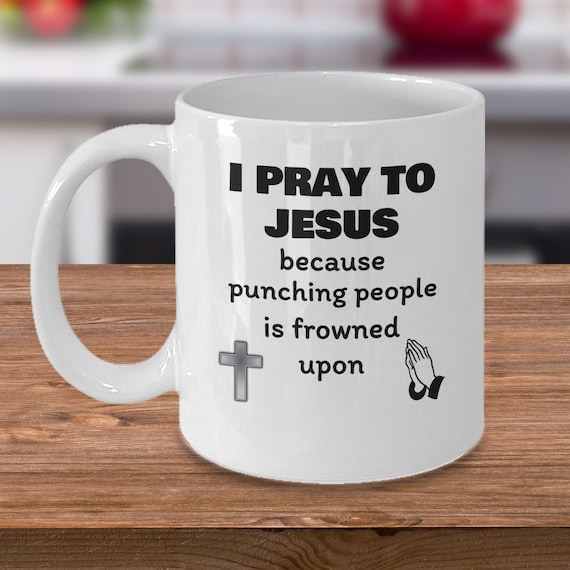
Identify the location of white cabinet under counter, left center. (13, 177).